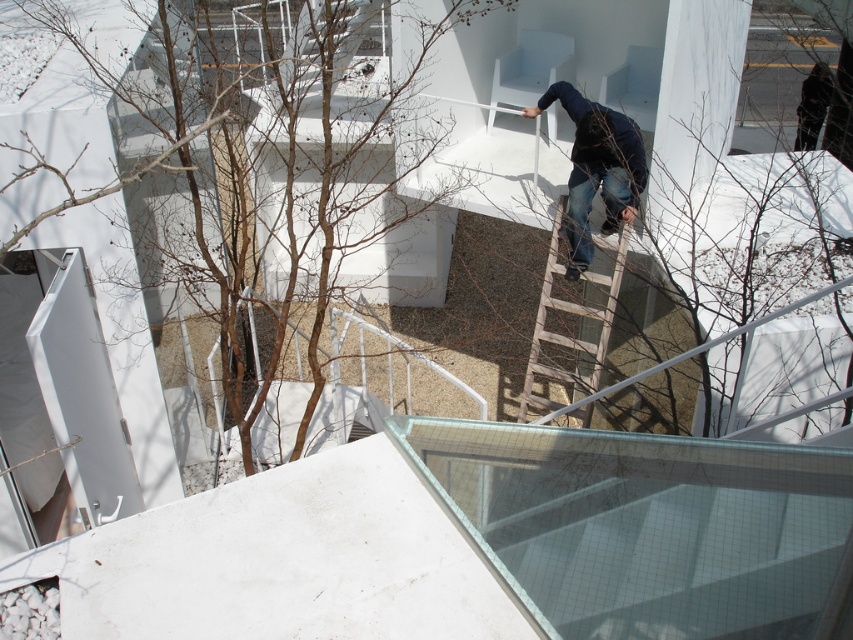
Question: Which of the following is the closest to the observer?

Choices:
 (A) (572, 92)
 (B) (549, 348)

Answer: (A)

Question: Is wooden at center to the left of blue jeans at center from the viewer's perspective?

Choices:
 (A) yes
 (B) no

Answer: (B)

Question: Does wooden at center appear on the right side of blue jeans at center?

Choices:
 (A) no
 (B) yes

Answer: (B)

Question: Does wooden at center lie behind blue jeans at center?

Choices:
 (A) no
 (B) yes

Answer: (B)